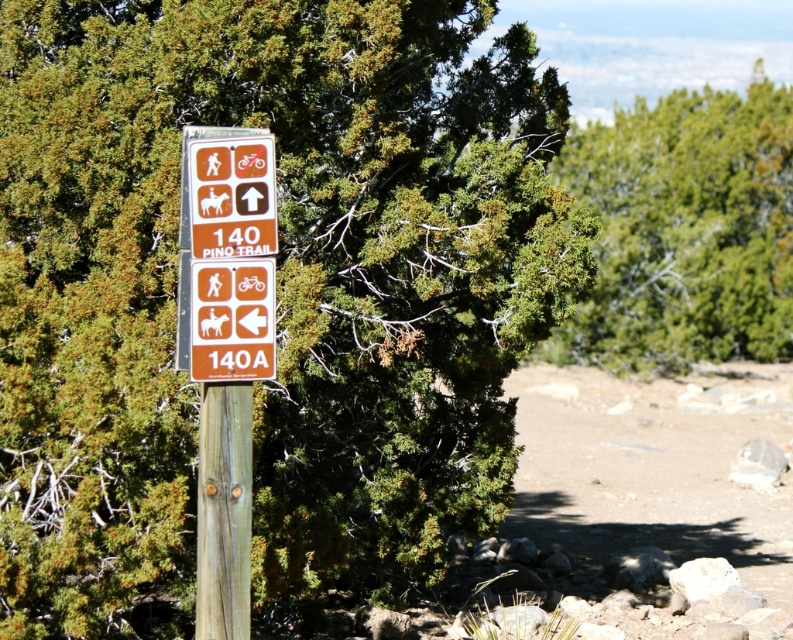
Can you confirm if green leafy tree at upper center is thinner than orange matte sign at center?

Incorrect, green leafy tree at upper center's width is not less than orange matte sign at center's.

Where is `green leafy tree at upper center`? This screenshot has width=793, height=640. green leafy tree at upper center is located at coordinates (684, 230).

This screenshot has width=793, height=640. I want to click on green leafy tree at upper center, so click(684, 230).

Is point (205, 460) less distant than point (190, 346)?

Yes, point (205, 460) is in front of point (190, 346).

Does brown wood post at center have a larger size compared to orange matte sign at center?

Yes.

This screenshot has height=640, width=793. In order to click on brown wood post at center in this screenshot , I will do `click(223, 509)`.

Which is more to the left, green leafy tree at upper center or brown wood post at center?

brown wood post at center

Between point (686, 280) and point (228, 506), which one is positioned in front?

Point (228, 506) is more forward.

Where is `green leafy tree at upper center`? The width and height of the screenshot is (793, 640). green leafy tree at upper center is located at coordinates (684, 230).